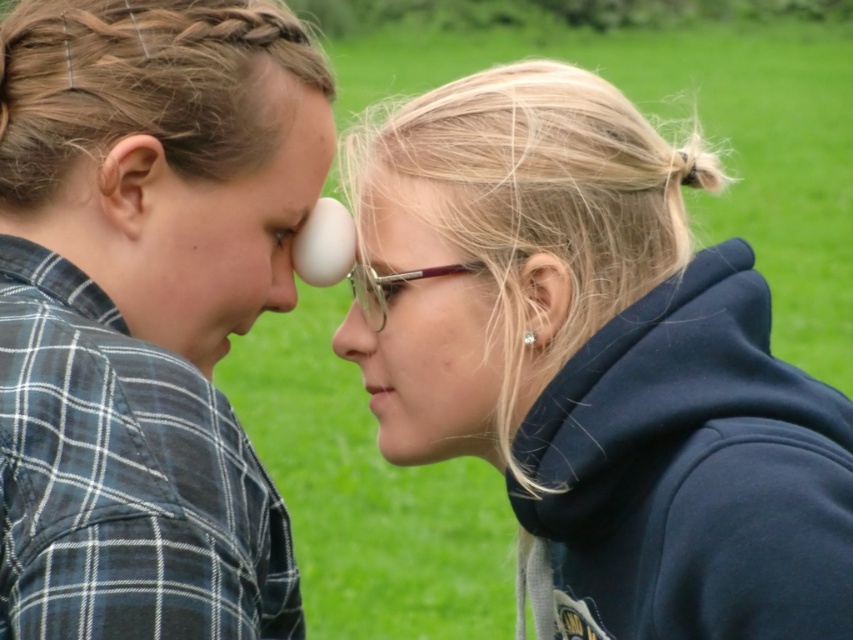
Consider the image. You are a photographer trying to capture a closeup shot of the smooth white nose at center and the satin navy hoodie at right. Since you want both subjects to be in focus, you need to know their distance apart. Can you tell me how far apart they are?

The satin navy hoodie at right is positioned on the right side of smooth white nose at center, but the exact distance between them isn not provided in the description. Without specific measurements, I cannot determine their separation.

Based on the photo, you are standing at the center of the image. There is a point marked at coordinates point (608, 369). What object is located at that point?

The object at point (608, 369) is the satin navy hoodie at right.

You are organizing a costume party and need to ensure that the navy blue fleece sweatshirt at right can fit over the translucent plastic forehead at center. Based on the scene description, will the sweatshirt accommodate the forehead piece?

The navy blue fleece sweatshirt at right has a larger width than the translucent plastic forehead at center, so it should accommodate the forehead piece comfortably.